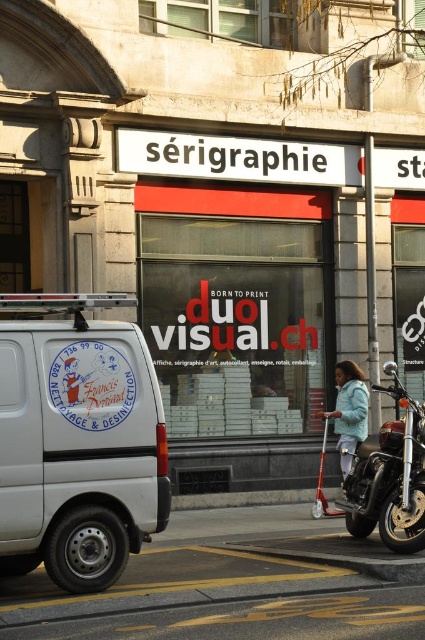
You are a delivery person needing to park your 1.8m wide truck between the shiny chrome motorcycle at right and the light blue fabric jacket at center. Can your truck fit in the space between them?

The shiny chrome motorcycle at right is wider than the light blue fabric jacket at center. Since the motorcycle is wider, the space between them might be insufficient for a 1.8m wide truck. However, without exact measurements, it is uncertain. Please check the actual space before attempting to park.

You are standing on the sidewalk in front of the storefront. You want to cross the street to reach the park on the other side. The crosswalk is 10 meters away from you. Can you safely cross the street before the white matte van at left passes by if the van is approaching at a speed of 15 km per hour?

The white matte van at left is 7.47 meters away from the viewer. To determine if you can cross the 10 meter crosswalk before the van arrives, calculate the time. The van is moving at 15 km per hour, which is 4.17 meters per second. The van needs 7.47 meters divided by 4.17 mps equals approximately 1.8 seconds to reach your position. The crosswalk is 10 meters, so at a walking speed of 1.4 mps, it would take about 7.1 seconds. Since 7.1 seconds is more than 1.8 seconds, the van will arrive before you finish,

You are standing in front of the storefront and want to take a photo of the shiny chrome motorcycle at right without including the van. Where should you position yourself relative to the storefront?

You should position yourself to the right side of the storefront to capture the shiny chrome motorcycle at right while avoiding the van parked on the left side of the frame.